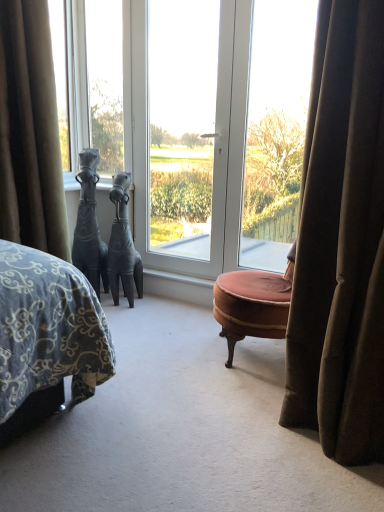
Identify the location of free region under velvet brown ottoman at center (from a real-world perspective). Image resolution: width=384 pixels, height=512 pixels. (255, 354).